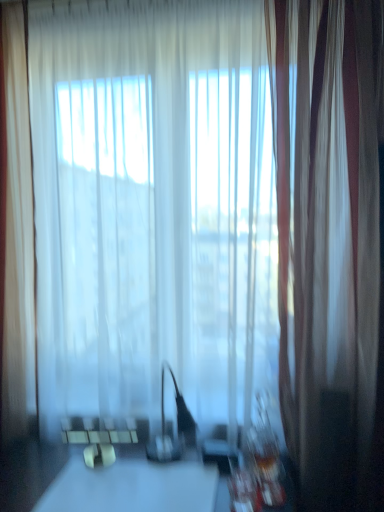
Question: Considering the relative positions of translucent white curtain at left, arranged as the second curtain when viewed from the right, and silky white curtain at right, the second curtain in the left-to-right sequence, in the image provided, is translucent white curtain at left, arranged as the second curtain when viewed from the right, behind silky white curtain at right, the second curtain in the left-to-right sequence,?

Choices:
 (A) yes
 (B) no

Answer: (A)

Question: Is translucent white curtain at left, the first curtain positioned from the left, not inside silky white curtain at right, the second curtain in the left-to-right sequence?

Choices:
 (A) yes
 (B) no

Answer: (A)

Question: Is translucent white curtain at left, the first curtain positioned from the left, taller than silky white curtain at right, the second curtain in the left-to-right sequence?

Choices:
 (A) no
 (B) yes

Answer: (A)

Question: From a real-world perspective, is translucent white curtain at left, arranged as the second curtain when viewed from the right, under silky white curtain at right, the second curtain in the left-to-right sequence?

Choices:
 (A) yes
 (B) no

Answer: (B)

Question: Considering the relative sizes of translucent white curtain at left, the first curtain positioned from the left, and silky white curtain at right, the first curtain in the right-to-left sequence, in the image provided, is translucent white curtain at left, the first curtain positioned from the left, wider than silky white curtain at right, the first curtain in the right-to-left sequence,?

Choices:
 (A) yes
 (B) no

Answer: (B)

Question: Choose the correct answer: Is white glossy table at center inside translucent white curtain at left, the first curtain positioned from the left, or outside it?

Choices:
 (A) inside
 (B) outside

Answer: (B)

Question: From a real-world perspective, is white glossy table at center positioned above or below translucent white curtain at left, the first curtain positioned from the left?

Choices:
 (A) above
 (B) below

Answer: (B)

Question: Is point (104, 495) positioned closer to the camera than point (28, 426)?

Choices:
 (A) farther
 (B) closer

Answer: (B)

Question: In terms of width, does white glossy table at center look wider or thinner when compared to translucent white curtain at left, the first curtain positioned from the left?

Choices:
 (A) wide
 (B) thin

Answer: (A)

Question: Is translucent white curtain at left, the first curtain positioned from the left, bigger or smaller than silky white curtain at right, the second curtain in the left-to-right sequence?

Choices:
 (A) big
 (B) small

Answer: (B)

Question: Considering the positions of translucent white curtain at left, the first curtain positioned from the left, and silky white curtain at right, the second curtain in the left-to-right sequence, in the image, is translucent white curtain at left, the first curtain positioned from the left, taller or shorter than silky white curtain at right, the second curtain in the left-to-right sequence,?

Choices:
 (A) short
 (B) tall

Answer: (A)

Question: From a real-world perspective, is translucent white curtain at left, arranged as the second curtain when viewed from the right, above or below silky white curtain at right, the second curtain in the left-to-right sequence?

Choices:
 (A) below
 (B) above

Answer: (B)

Question: From the image's perspective, is translucent white curtain at left, the first curtain positioned from the left, positioned above or below silky white curtain at right, the second curtain in the left-to-right sequence?

Choices:
 (A) below
 (B) above

Answer: (B)

Question: In terms of size, does translucent white curtain at left, arranged as the second curtain when viewed from the right, appear bigger or smaller than white glossy table at center?

Choices:
 (A) small
 (B) big

Answer: (A)

Question: In terms of width, does translucent white curtain at left, arranged as the second curtain when viewed from the right, look wider or thinner when compared to white glossy table at center?

Choices:
 (A) wide
 (B) thin

Answer: (B)